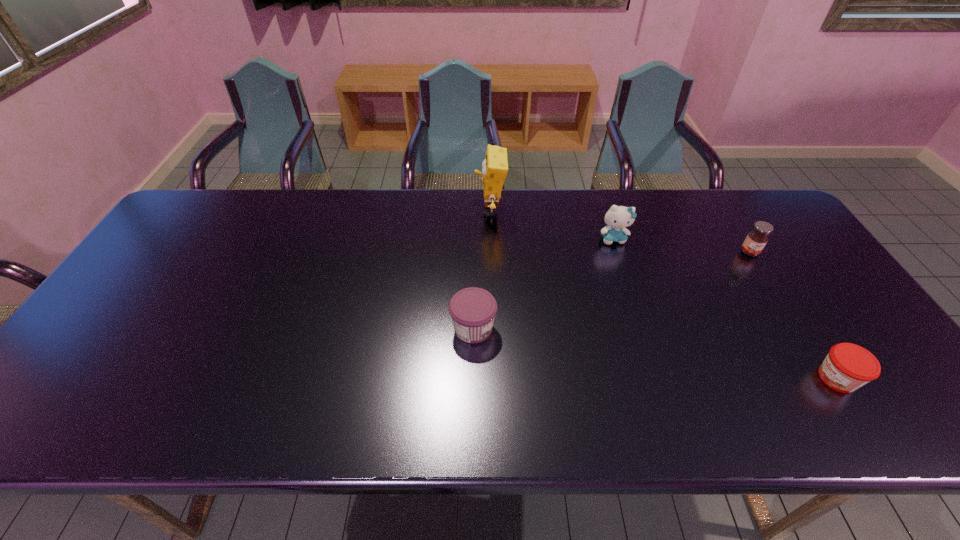
You are a GUI agent. You are given a task and a screenshot of the screen. Output one action in this format:
    pyautogui.click(x=<x>, y=<y>)
    Task: Click on the vacant area in the image that satisfies the following two spatial constraints: 1. on the face of the kitten; 2. on the front label of the second nearest object
    This screenshot has width=960, height=540.
    Given the screenshot: What is the action you would take?
    pyautogui.click(x=642, y=328)

Where is `vacant region that satisfies the following two spatial constraints: 1. on the label side of the farthest jam; 2. on the front label of the fourth farthest object`? vacant region that satisfies the following two spatial constraints: 1. on the label side of the farthest jam; 2. on the front label of the fourth farthest object is located at coordinates (797, 328).

Locate an element on the screen. This screenshot has width=960, height=540. vacant position in the image that satisfies the following two spatial constraints: 1. on the label side of the farthest jam; 2. on the front label of the leftmost jam is located at coordinates (797, 328).